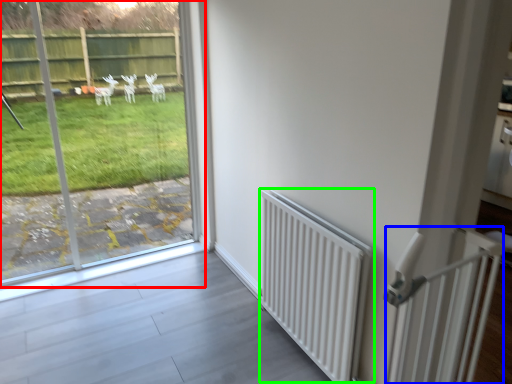
Question: Which object is the farthest from window (highlighted by a red box)? Choose among these: balustrade (highlighted by a blue box) or radiator (highlighted by a green box).

Choices:
 (A) balustrade
 (B) radiator

Answer: (A)